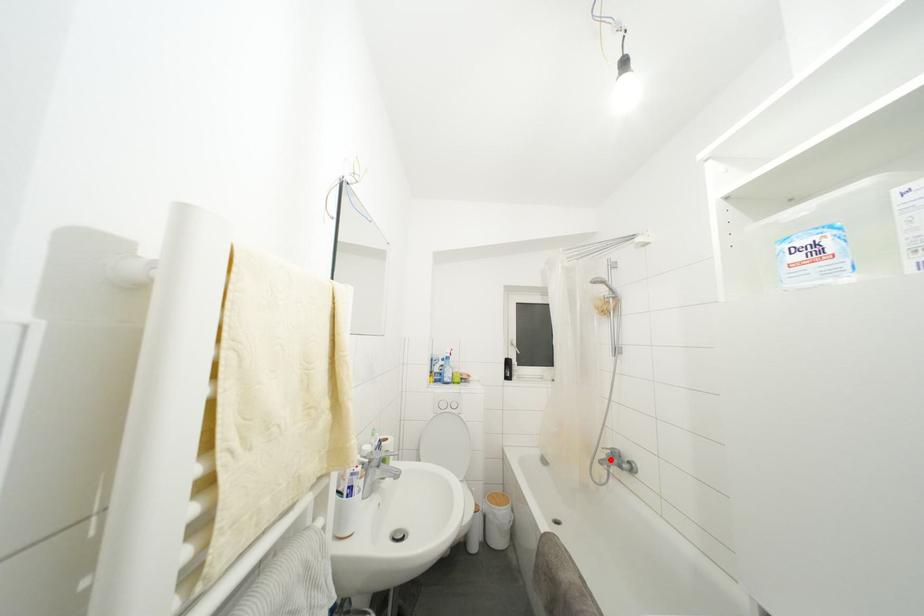
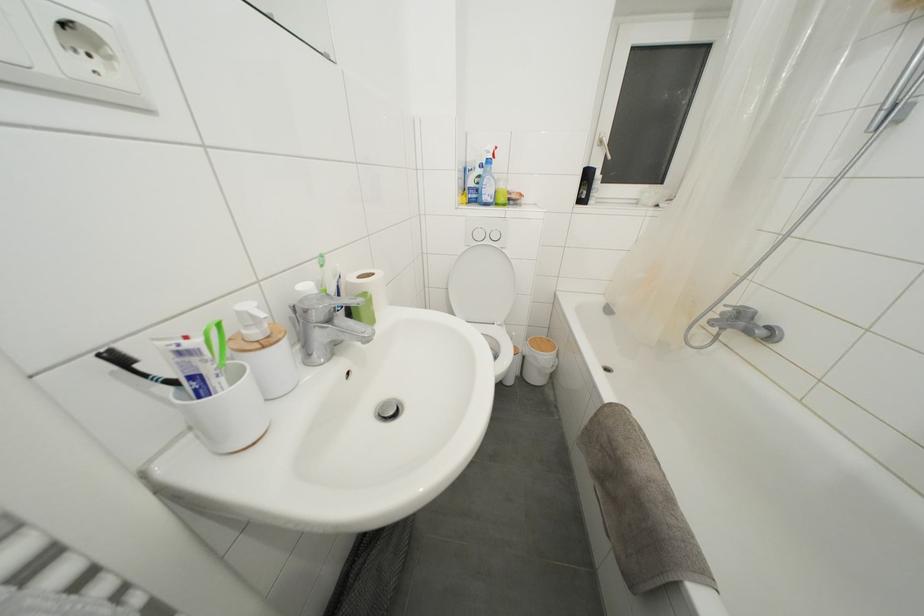
Question: I am providing you with two images of the same scene from different viewpoints. Image1 has a red point marked. In image2, the corresponding 3D location appears at what relative position? Reply with the corresponding letter.

Choices:
 (A) Closer
 (B) Farther

Answer: (A)